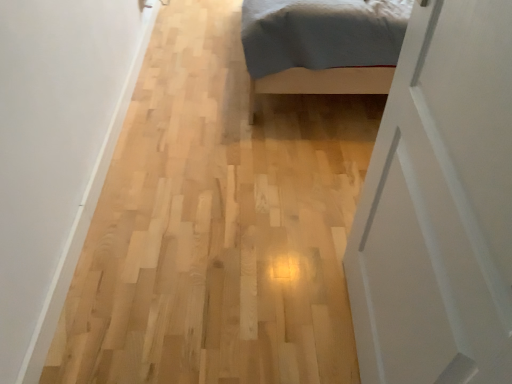
Locate an element on the screen. The width and height of the screenshot is (512, 384). white matte door at right is located at coordinates (439, 206).

What do you see at coordinates (439, 206) in the screenshot? This screenshot has height=384, width=512. I see `white matte door at right` at bounding box center [439, 206].

Measure the distance between white matte door at right and camera.

20.58 inches.

Where is `white matte door at right`? white matte door at right is located at coordinates (439, 206).